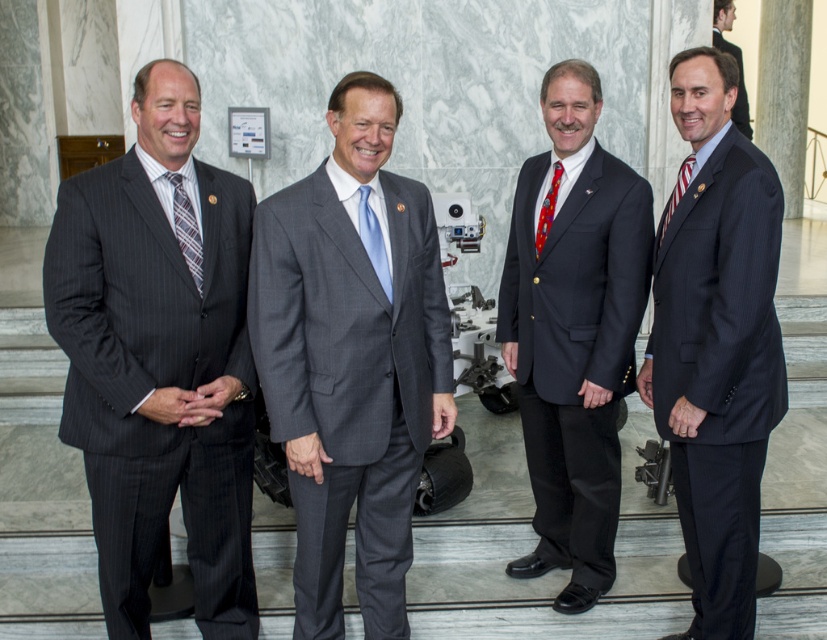
You are a photographer at the event and need to adjust the lighting to ensure both the gray pinstripe suit at center and the matte black suit at center are well lit. Which suit is positioned lower and might require more direct lighting to avoid shadows?

The gray pinstripe suit at center is below the matte black suit at center, so it might require more direct lighting to avoid shadows.

Please provide the coordinates of the gray pinstripe suit at center in the image. The coordinate system has the origin at the bottom left corner of the image, with the x and y axes increasing to the right and up respectively.

The gray pinstripe suit at center is located at coordinates point (349, 384).

You are a photographer adjusting your camera settings to capture the best possible image. You notice two ties in the scene, the plaid silk tie at left and the red satin tie at center. Which tie should you focus on to ensure it appears sharp and in focus if you want the one that is closer to the camera?

The plaid silk tie at left is closer to the viewer, so focusing on it will ensure it appears sharp and in focus.